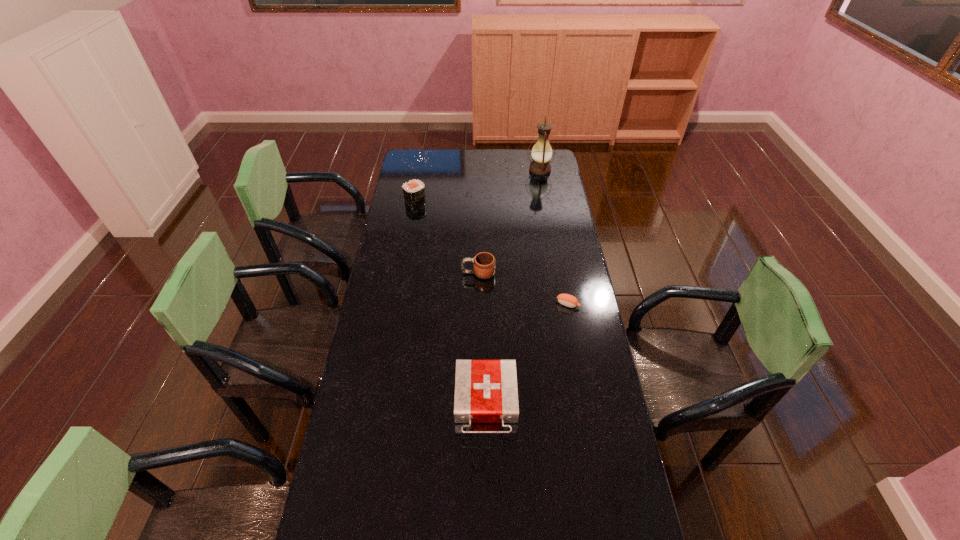
At what (x,y) coordinates should I click in order to perform the action: click on oil lamp. Please return your answer as a coordinate pair (x, y). Looking at the image, I should click on 541,153.

Where is `the farthest object`? The height and width of the screenshot is (540, 960). the farthest object is located at coordinates (541, 153).

This screenshot has width=960, height=540. I want to click on the taller sushi, so click(x=414, y=191).

I want to click on the leftmost object, so click(x=414, y=191).

Where is `mug`? mug is located at coordinates (484, 263).

At what (x,y) coordinates should I click in order to perform the action: click on the third nearest object. Please return your answer as a coordinate pair (x, y). The width and height of the screenshot is (960, 540). Looking at the image, I should click on (484, 263).

At what (x,y) coordinates should I click in order to perform the action: click on the first-aid kit. Please return your answer as a coordinate pair (x, y). The width and height of the screenshot is (960, 540). Looking at the image, I should click on (486, 391).

This screenshot has height=540, width=960. Find the location of `the nearest object`. the nearest object is located at coordinates (486, 391).

Where is `the right sushi`? the right sushi is located at coordinates (568, 300).

This screenshot has height=540, width=960. I want to click on the shorter sushi, so click(568, 300).